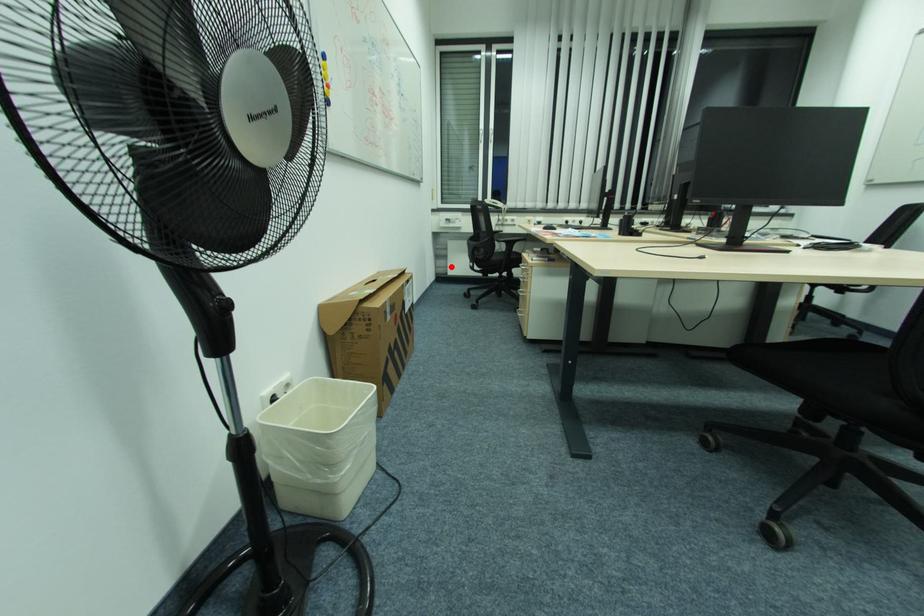
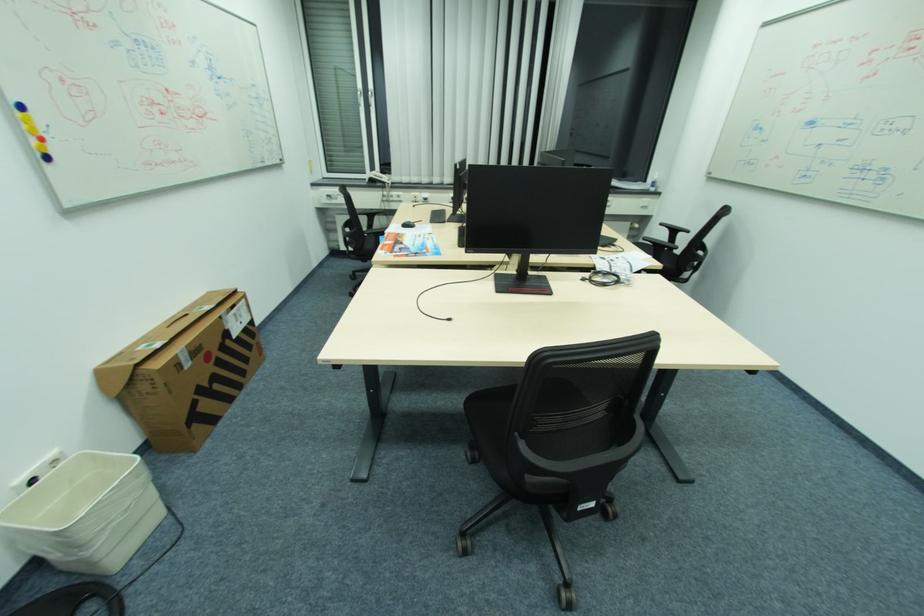
Question: I am providing you with two images of the same scene from different viewpoints. A red point is shown in image1. For the corresponding object point in image2, is it positioned nearer or farther from the camera?

Choices:
 (A) Nearer
 (B) Farther

Answer: (B)